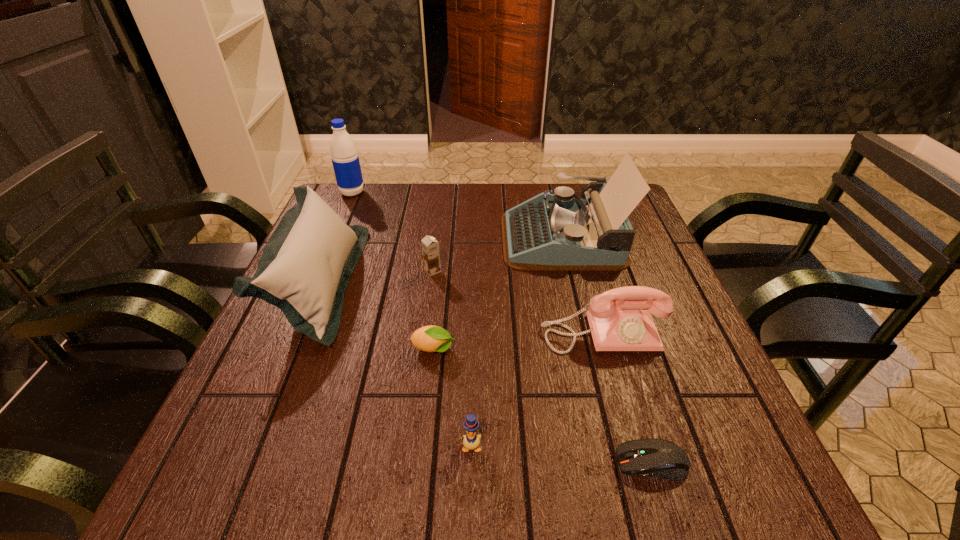
Image resolution: width=960 pixels, height=540 pixels. What are the coordinates of `object located in the far left corner section of the desktop` in the screenshot? It's located at (345, 159).

You are a GUI agent. You are given a task and a screenshot of the screen. Output one action in this format:
    pyautogui.click(x=<x>, y=<y>)
    Task: Click on the object at the far right corner
    This screenshot has height=540, width=960.
    Given the screenshot: What is the action you would take?
    pyautogui.click(x=550, y=232)

At what (x,y) coordinates should I click in order to perform the action: click on object present at the near right corner. Please return your answer as a coordinate pair (x, y). Looking at the image, I should click on (659, 458).

This screenshot has width=960, height=540. What are the coordinates of `vacant space at the far edge of the desktop` in the screenshot? It's located at (473, 221).

Where is `vacant space at the near edge of the desktop`? vacant space at the near edge of the desktop is located at coordinates (547, 505).

The width and height of the screenshot is (960, 540). Find the location of `free region at the left edge`. free region at the left edge is located at coordinates (361, 261).

The height and width of the screenshot is (540, 960). In the image, there is a desktop. What are the coordinates of `vacant space at the right edge` in the screenshot? It's located at (618, 282).

I want to click on free space at the near right corner of the desktop, so click(x=746, y=489).

Locate an element on the screen. free space between the shortest object and the lemon is located at coordinates (542, 406).

The image size is (960, 540). Identify the location of vacant space that is in between the fourth shortest object and the shortest object. (542, 367).